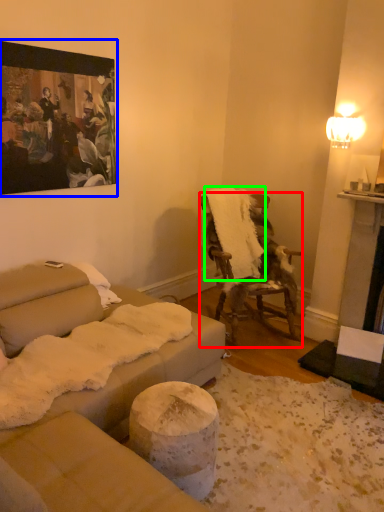
Question: Which is farther away from chair (highlighted by a red box)? picture frame (highlighted by a blue box) or blanket (highlighted by a green box)?

Choices:
 (A) picture frame
 (B) blanket

Answer: (A)